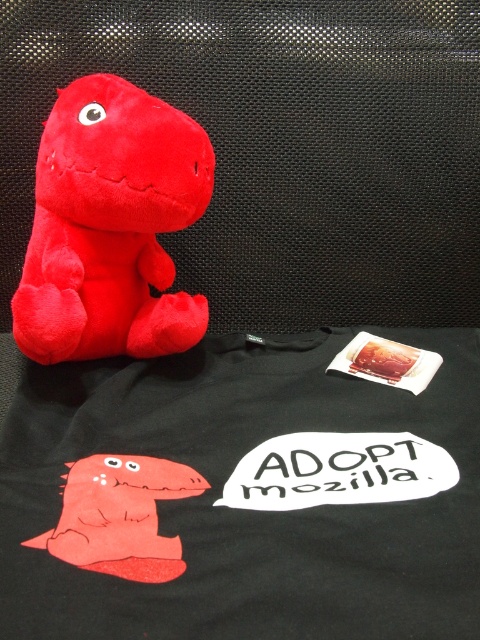
Question: Which object is positioned closest to the matte plush dinosaur at upper left?

Choices:
 (A) matte plush dinosaur at center
 (B) black cotton t-shirt at upper center

Answer: (B)

Question: Is black cotton t-shirt at upper center closer to the viewer compared to matte plush dinosaur at center?

Choices:
 (A) no
 (B) yes

Answer: (B)

Question: Which of the following is the farthest from the observer?

Choices:
 (A) 93,275
 (B) 166,547
 (C) 223,420

Answer: (A)

Question: Is black cotton t-shirt at upper center to the left of matte plush dinosaur at upper left from the viewer's perspective?

Choices:
 (A) yes
 (B) no

Answer: (B)

Question: Which of these objects is positioned farthest from the matte plush dinosaur at upper left?

Choices:
 (A) black cotton t-shirt at upper center
 (B) matte plush dinosaur at center

Answer: (B)

Question: Can you confirm if matte plush dinosaur at center is positioned below matte plush dinosaur at upper left?

Choices:
 (A) no
 (B) yes

Answer: (A)